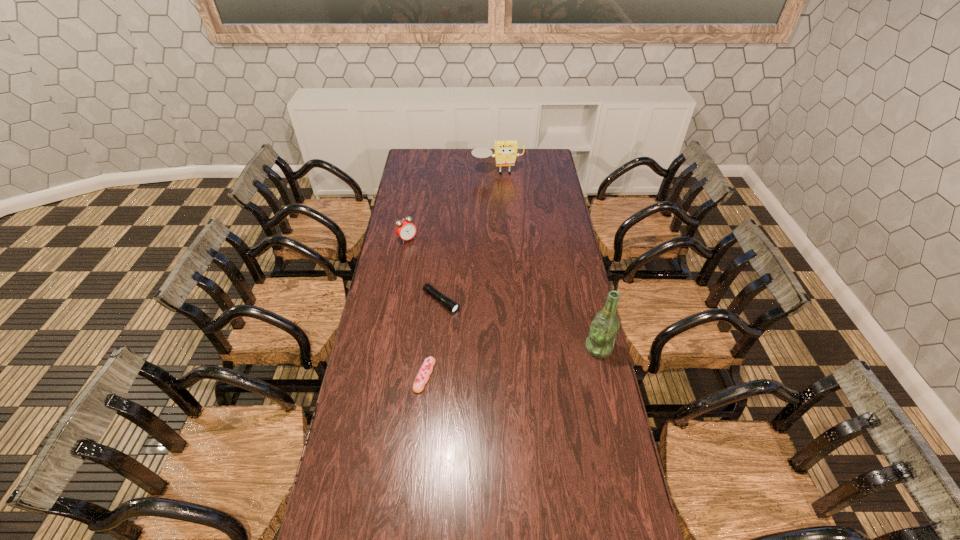
Find the location of a particular element. The image size is (960, 540). vacant space situated 0.260m on the front-facing side of the farthest object is located at coordinates (505, 206).

This screenshot has width=960, height=540. Identify the location of object that is positioned at the far edge. (505, 154).

Identify the location of object positioned at the left edge. (405, 229).

Identify the location of object located in the right edge section of the desktop. The image size is (960, 540). coord(603,330).

The width and height of the screenshot is (960, 540). In the image, there is a desktop. Find the location of `vacant space at the far edge`. vacant space at the far edge is located at coordinates (490, 161).

You are a GUI agent. You are given a task and a screenshot of the screen. Output one action in this format:
    pyautogui.click(x=<x>, y=<y>)
    Task: Click on the vacant space at the left edge of the desktop
    Image resolution: width=960 pixels, height=540 pixels.
    Given the screenshot: What is the action you would take?
    pyautogui.click(x=401, y=189)

You are a GUI agent. You are given a task and a screenshot of the screen. Output one action in this format:
    pyautogui.click(x=<x>, y=<y>)
    Task: Click on the blank space at the right edge of the desktop
    
    Given the screenshot: What is the action you would take?
    pyautogui.click(x=548, y=172)

Where is `vacant space at the far left corner of the desktop`? This screenshot has width=960, height=540. vacant space at the far left corner of the desktop is located at coordinates (429, 150).

The width and height of the screenshot is (960, 540). I want to click on free space between the alarm clock and the tallest object, so click(x=503, y=294).

Find the location of a particular element. The height and width of the screenshot is (540, 960). vacant space that is in between the rightmost object and the flashlight is located at coordinates (520, 325).